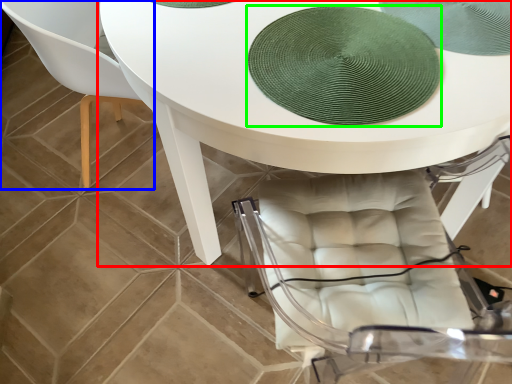
Question: Which is farther away from table (highlighted by a red box)? chair (highlighted by a blue box) or mat (highlighted by a green box)?

Choices:
 (A) chair
 (B) mat

Answer: (A)